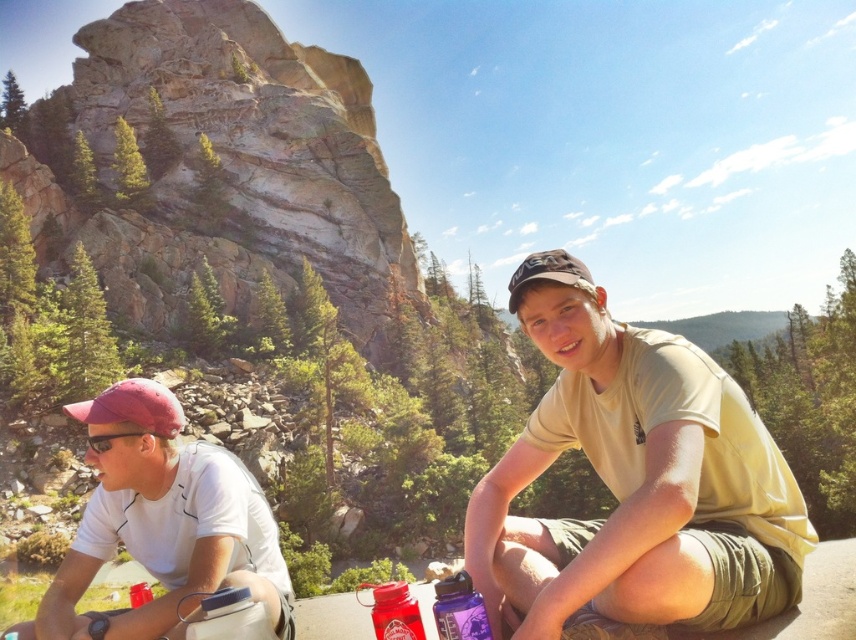
You are planning to take a photo of the rustic stone mountain at upper left and the purple matte water bottle at lower center. Which object is wider?

The rustic stone mountain at upper left is wider than the purple matte water bottle at lower center.

You are a photographer trying to capture a photo of the purple matte water bottle at lower center without including the white matte shirt at left in the frame. Given their positions, is this possible?

The white matte shirt at left is above the purple matte water bottle at lower center, so if you position your camera to focus on the lower area where the water bottle is located, you can exclude the shirt by adjusting the angle or cropping the image accordingly.